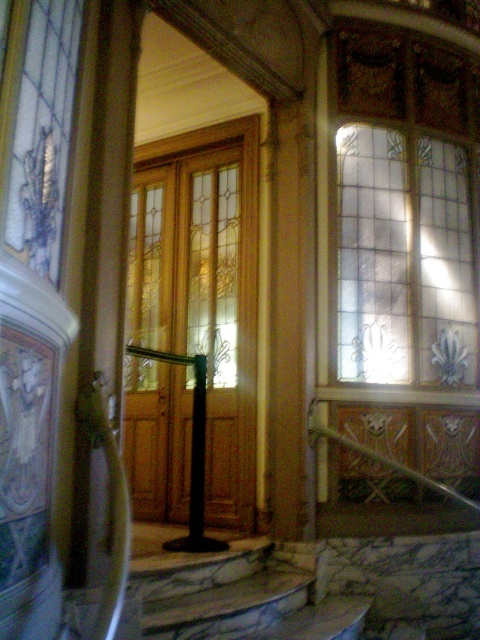
Question: Which object is positioned closest to the stained glass at upper right?

Choices:
 (A) marble stairs at lower center
 (B) translucent wood door at center

Answer: (B)

Question: Is stained glass at upper right to the right of marble stairs at lower center from the viewer's perspective?

Choices:
 (A) yes
 (B) no

Answer: (A)

Question: Estimate the real-world distances between objects in this image. Which object is closer to the stained glass at upper right?

Choices:
 (A) translucent wood door at center
 (B) marble stairs at lower center

Answer: (A)

Question: Which of the following is the farthest from the observer?

Choices:
 (A) (448, 333)
 (B) (180, 152)
 (C) (145, 612)

Answer: (B)

Question: Considering the relative positions of translucent wood door at center and stained glass at upper right in the image provided, where is translucent wood door at center located with respect to stained glass at upper right?

Choices:
 (A) right
 (B) left

Answer: (B)

Question: Does translucent wood door at center have a lesser width compared to stained glass at upper right?

Choices:
 (A) yes
 (B) no

Answer: (A)